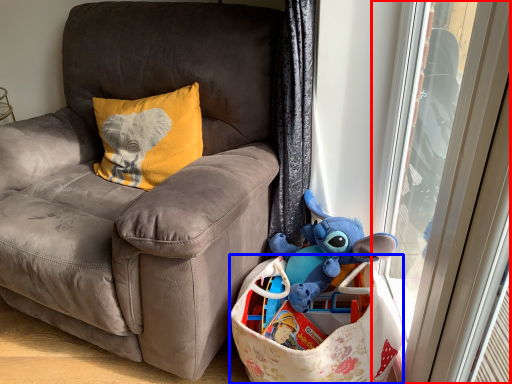
Question: Among these objects, which one is nearest to the camera, screen door (highlighted by a red box) or shopping bag (highlighted by a blue box)?

Choices:
 (A) screen door
 (B) shopping bag

Answer: (A)